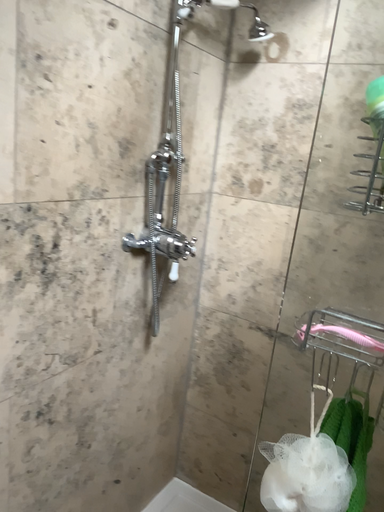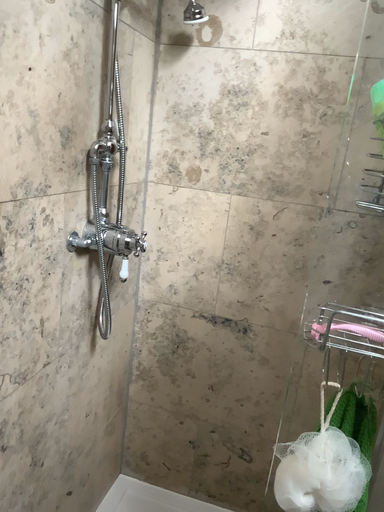
Question: Which way did the camera rotate in the video?

Choices:
 (A) rotated right
 (B) rotated left

Answer: (A)